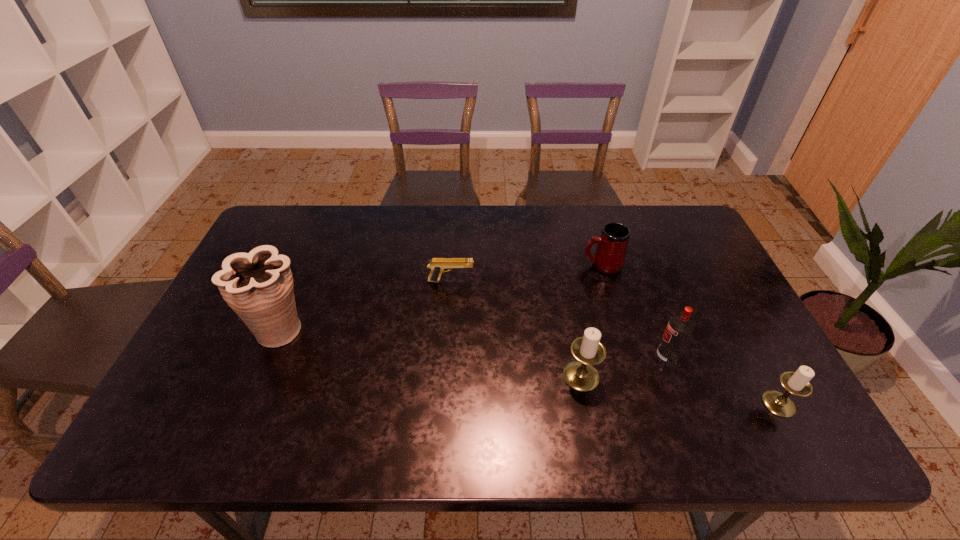
The height and width of the screenshot is (540, 960). I want to click on the shortest object, so click(x=438, y=266).

Locate an element on the screen. This screenshot has width=960, height=540. free space located 0.120m on the back of the third object from left to right is located at coordinates (571, 324).

Find the location of a particular element. The height and width of the screenshot is (540, 960). free spot located on the left of the right candle holder is located at coordinates (625, 404).

Locate an element on the screen. The height and width of the screenshot is (540, 960). free space located on the right of the tallest object is located at coordinates (420, 329).

Where is `vacant space located 0.240m on the side of the third object from right to left with the handle`? This screenshot has width=960, height=540. vacant space located 0.240m on the side of the third object from right to left with the handle is located at coordinates (505, 265).

I want to click on vacant region located on the side of the third object from right to left with the handle, so point(453,265).

Find the location of a particular element. The image size is (960, 540). vacant space located 0.270m on the side of the third object from right to left with the handle is located at coordinates (495, 265).

The height and width of the screenshot is (540, 960). In order to click on vacant region located 0.150m on the front label of the second object from right to left in this screenshot , I will do `click(595, 357)`.

Image resolution: width=960 pixels, height=540 pixels. I want to click on vacant region located on the front label of the second object from right to left, so click(x=552, y=357).

The height and width of the screenshot is (540, 960). I want to click on vacant space situated on the front label of the second object from right to left, so click(568, 357).